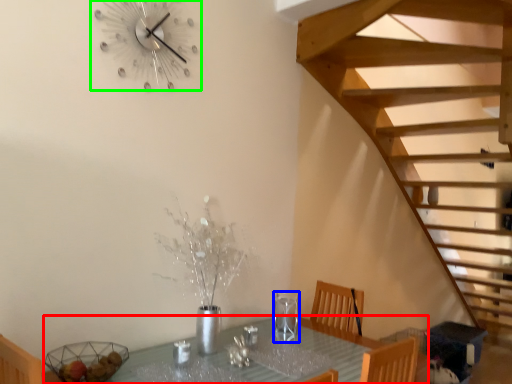
Question: Which object is the closest to the table (highlighted by a red box)? Choose among these: wine glass (highlighted by a blue box) or wall clock (highlighted by a green box).

Choices:
 (A) wine glass
 (B) wall clock

Answer: (A)